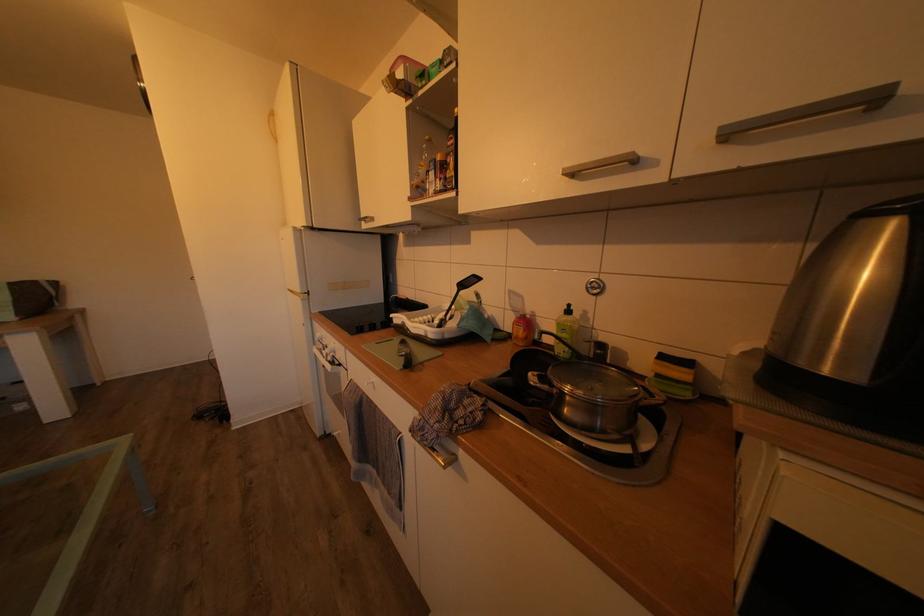
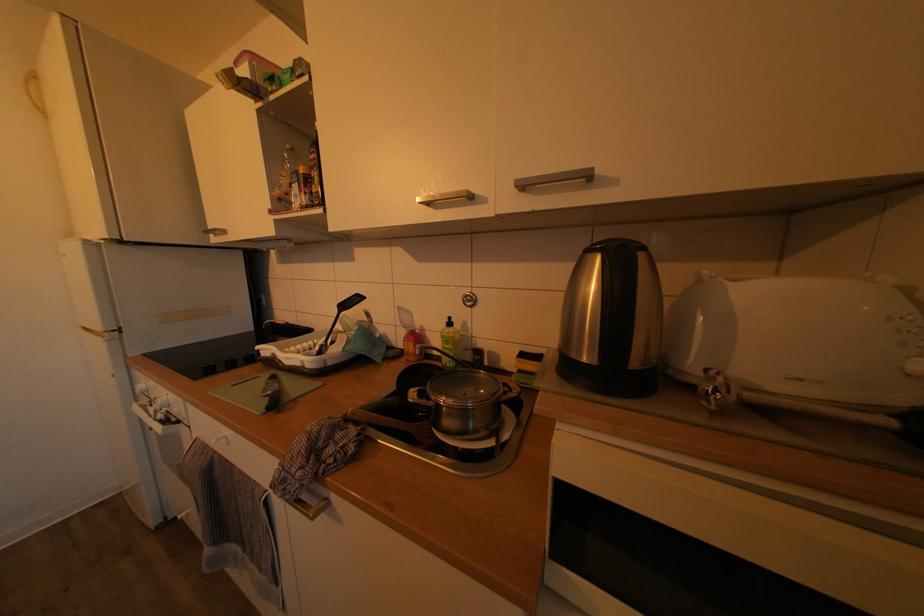
Question: The camera is either moving clockwise (left) or counter-clockwise (right) around the object. The first image is from the beginning of the video and the second image is from the end. Is the camera moving left or right when shooting the video?

Choices:
 (A) Left
 (B) Right

Answer: (A)